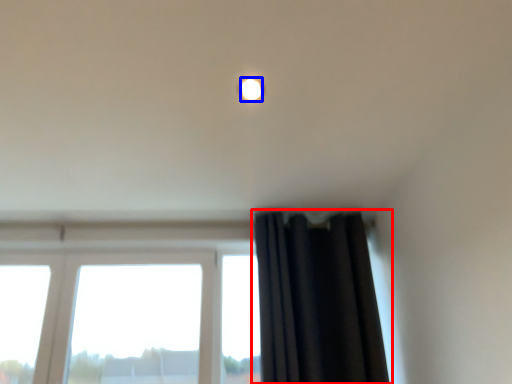
Question: Which of the following is the closest to the observer, curtain (highlighted by a red box) or lighting (highlighted by a blue box)?

Choices:
 (A) curtain
 (B) lighting

Answer: (B)